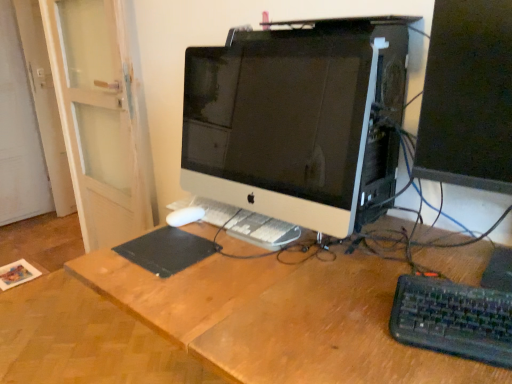
Identify the location of vacant space behind matte black monitor at right, the 2th computer monitor from the left. The width and height of the screenshot is (512, 384). (417, 228).